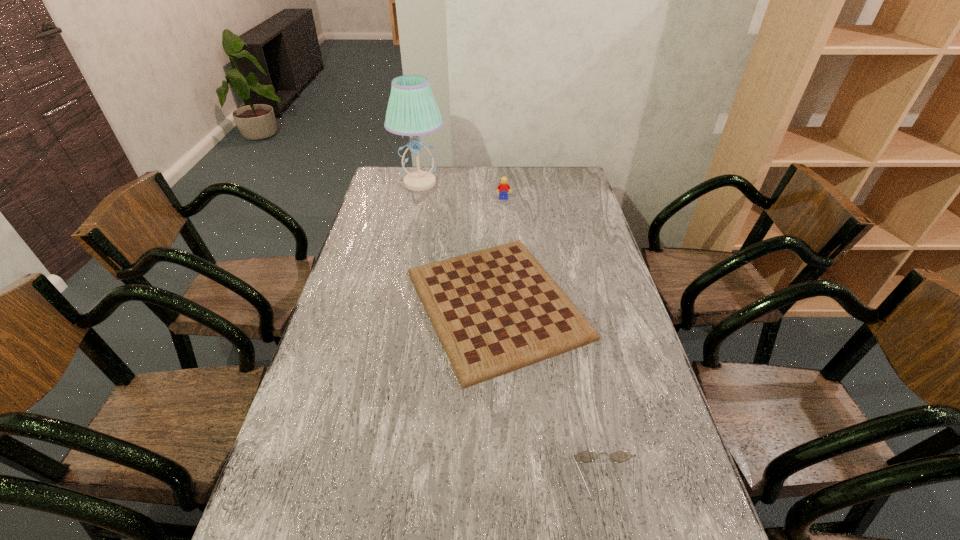
Identify the location of object positioned at the left edge. (412, 110).

The width and height of the screenshot is (960, 540). I want to click on spectacles that is at the right edge, so click(x=585, y=456).

Where is `gameboard that is at the right edge`? This screenshot has height=540, width=960. gameboard that is at the right edge is located at coordinates (497, 310).

What are the coordinates of `object at the far left corner` in the screenshot? It's located at (412, 110).

Where is `free region at the left edge of the desktop`? free region at the left edge of the desktop is located at coordinates [290, 514].

The height and width of the screenshot is (540, 960). I want to click on free space at the right edge of the desktop, so click(x=579, y=264).

This screenshot has width=960, height=540. I want to click on free space that is in between the lamp and the third shortest object, so click(462, 191).

Where is `free space between the lamp and the third shortest object`? free space between the lamp and the third shortest object is located at coordinates (462, 191).

The width and height of the screenshot is (960, 540). In order to click on object that is the second closest to the lamp in this screenshot , I will do `click(497, 310)`.

Locate an element on the screen. This screenshot has width=960, height=540. object that can be found as the second closest to the lamp is located at coordinates (497, 310).